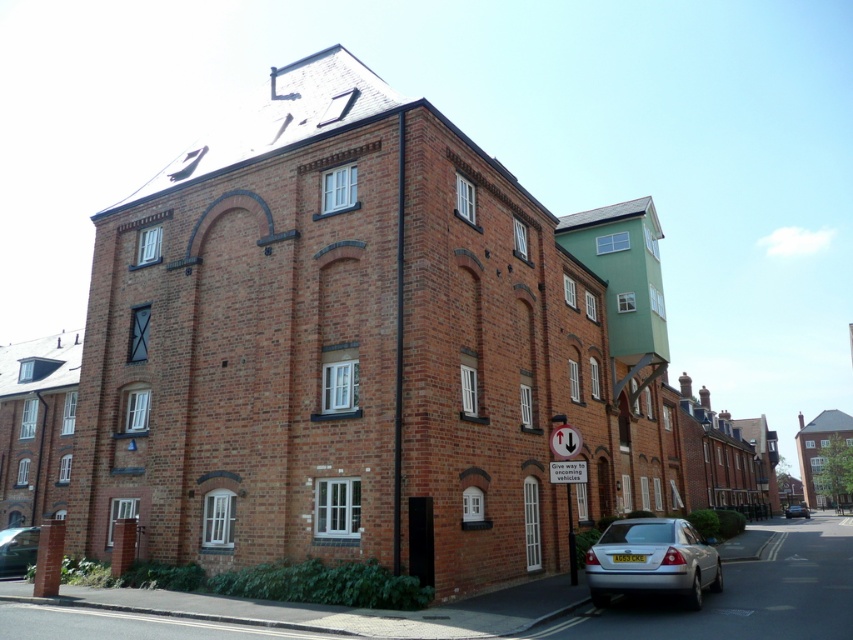
Question: Considering the relative positions of silver metallic sedan at lower right and silver metallic car at center in the image provided, where is silver metallic sedan at lower right located with respect to silver metallic car at center?

Choices:
 (A) above
 (B) below

Answer: (A)

Question: Based on their relative distances, which object is nearer to the silver metallic sedan at lower right?

Choices:
 (A) metallic silver car at lower left
 (B) white plastic sign at lower center

Answer: (B)

Question: Can you confirm if silver metallic sedan at lower right is positioned to the left of metallic silver car at lower left?

Choices:
 (A) yes
 (B) no

Answer: (B)

Question: Which object is farther from the camera taking this photo?

Choices:
 (A) metallic silver car at lower left
 (B) silver metallic sedan at lower right
 (C) white plastic sign at lower center
 (D) silver metallic car at center

Answer: (D)

Question: Considering the real-world distances, which object is closest to the metallic silver car at lower left?

Choices:
 (A) white plastic sign at lower center
 (B) silver metallic sedan at lower right
 (C) silver metallic car at center

Answer: (A)

Question: Where is silver metallic sedan at lower right located in relation to metallic silver car at lower left in the image?

Choices:
 (A) below
 (B) above

Answer: (B)